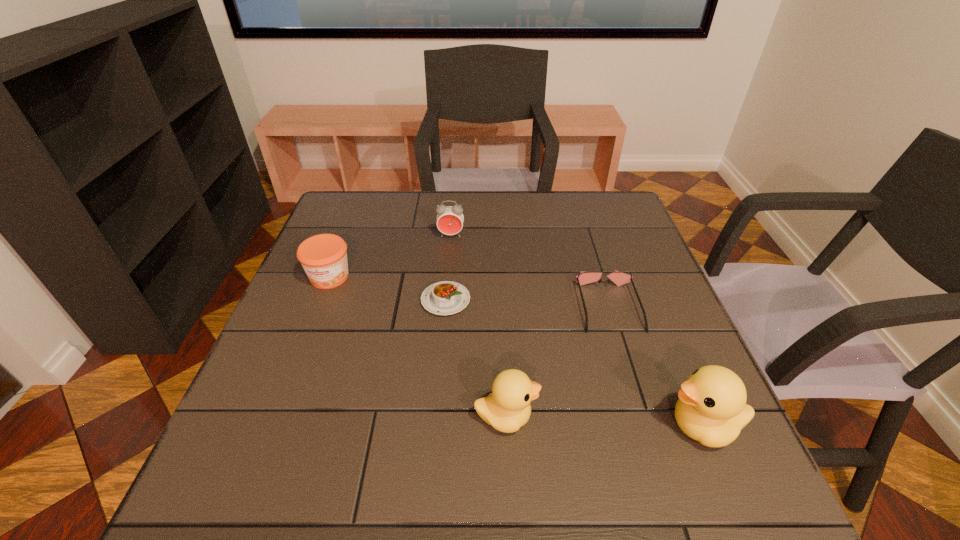
Observe the arrangement of all ducks in the image. To keep them evenly spaced, where would you place another duck on the left? Please locate a free space. Please provide its 2D coordinates. Your answer should be formatted as a tuple, i.e. [(x, y)], where the tuple contains the x and y coordinates of a point satisfying the conditions above.

[(316, 408)]